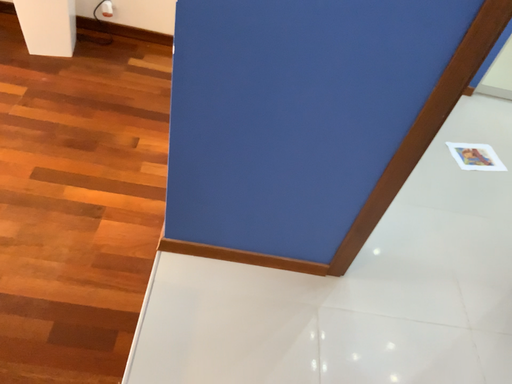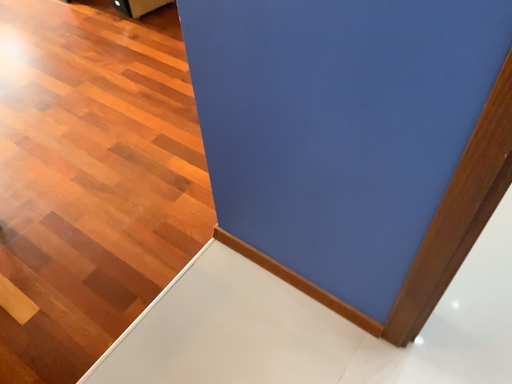
Question: Which way did the camera rotate in the video?

Choices:
 (A) rotated left
 (B) rotated right

Answer: (A)